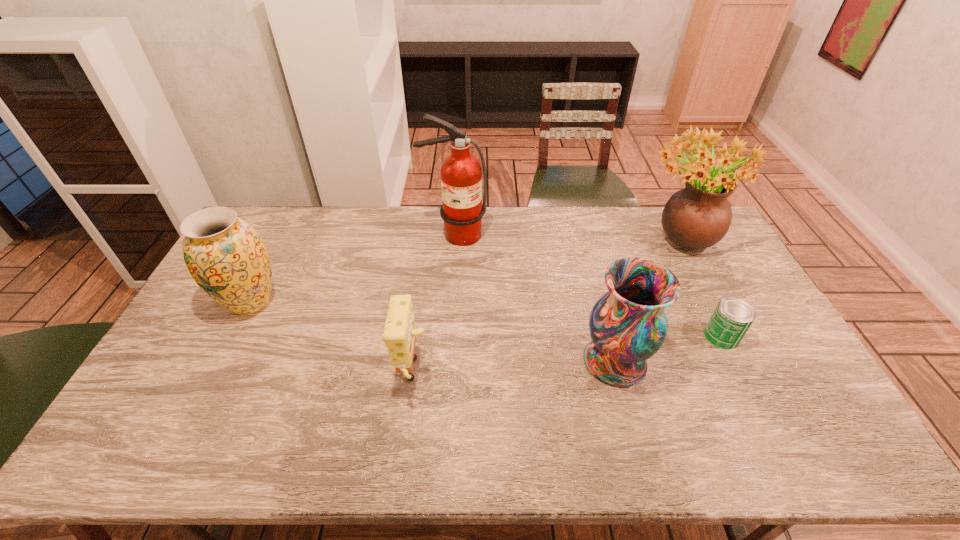
The image size is (960, 540). What are the coordinates of `free spot at the far edge of the desktop` in the screenshot? It's located at (549, 215).

At what (x,y) coordinates should I click in order to perform the action: click on vacant area at the near edge. Please return your answer as a coordinate pair (x, y). The height and width of the screenshot is (540, 960). Looking at the image, I should click on (490, 458).

Where is `vacant space at the left edge`? This screenshot has height=540, width=960. vacant space at the left edge is located at coordinates coord(212,300).

Locate an element on the screen. vacant space at the right edge of the desktop is located at coordinates (715, 282).

At what (x,y) coordinates should I click in order to perform the action: click on free space at the far left corner. Please return your answer as a coordinate pair (x, y). The width and height of the screenshot is (960, 540). Looking at the image, I should click on (278, 211).

Find the location of a particular element. The image size is (960, 540). vacant space at the near left corner is located at coordinates (178, 449).

The height and width of the screenshot is (540, 960). I want to click on vacant space at the near right corner of the desktop, so click(807, 430).

Where is `free space between the left vase and the fifth tallest object`? This screenshot has height=540, width=960. free space between the left vase and the fifth tallest object is located at coordinates (332, 339).

In order to click on free spot between the fire extinguisher and the right vase in this screenshot , I will do `click(535, 298)`.

What are the coordinates of `free spot between the flower arrangement and the fire extinguisher` in the screenshot? It's located at (566, 238).